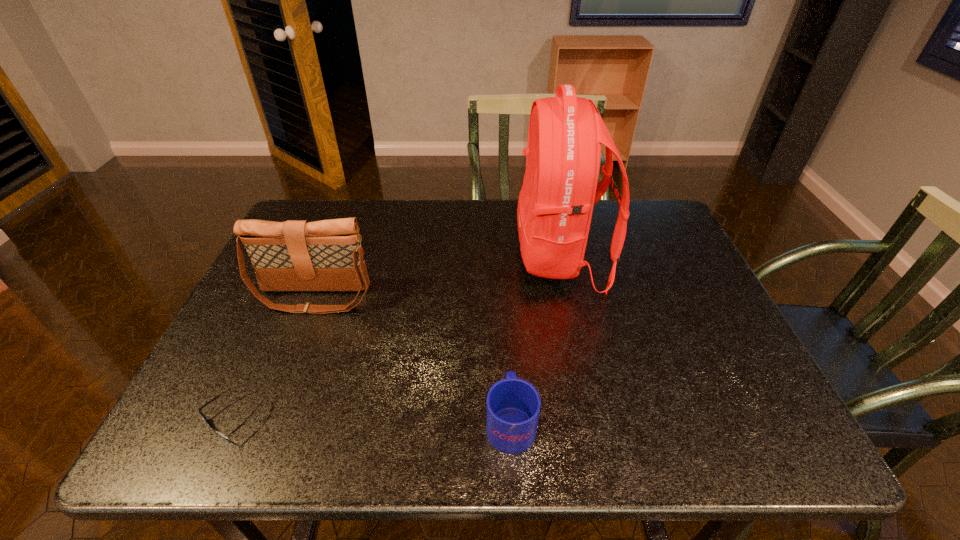
The height and width of the screenshot is (540, 960). I want to click on vacant point located between the sunglasses and the shoulder bag, so pos(275,356).

Find the location of a particular element. This screenshot has height=540, width=960. free space between the third shortest object and the shortest object is located at coordinates (275, 356).

The image size is (960, 540). I want to click on object that stands as the third closest to the mug, so click(x=203, y=416).

You are a GUI agent. You are given a task and a screenshot of the screen. Output one action in this format:
    pyautogui.click(x=<x>, y=<y>)
    Task: Click on the object identified as the closest to the second tallest object
    The image size is (960, 540).
    Given the screenshot: What is the action you would take?
    pyautogui.click(x=203, y=416)

Locate an element on the screen. The height and width of the screenshot is (540, 960). vacant area that satisfies the following two spatial constraints: 1. on the main compartment of the backpack; 2. on the front-facing side of the shoulder bag is located at coordinates (568, 296).

The width and height of the screenshot is (960, 540). Find the location of `free space that satisfies the following two spatial constraints: 1. on the main compartment of the tallest object; 2. on the front-facing side of the shoulder bag`. free space that satisfies the following two spatial constraints: 1. on the main compartment of the tallest object; 2. on the front-facing side of the shoulder bag is located at coordinates click(568, 296).

Locate an element on the screen. vacant region that satisfies the following two spatial constraints: 1. on the main compartment of the tallest object; 2. at the front of the shortest object showing the lenses is located at coordinates (593, 416).

I want to click on vacant space that satisfies the following two spatial constraints: 1. on the main compartment of the backpack; 2. at the front of the shortest object showing the lenses, so click(x=593, y=416).

I want to click on vacant space that satisfies the following two spatial constraints: 1. on the main compartment of the tallest object; 2. on the front-facing side of the shoulder bag, so click(568, 296).